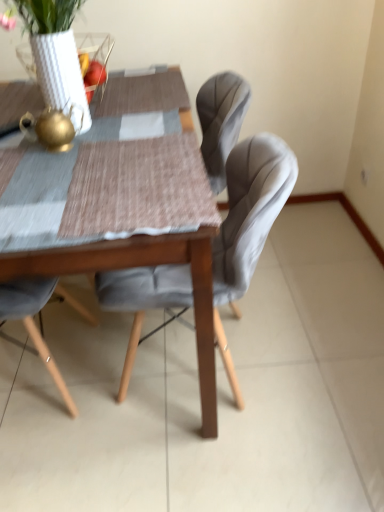
This screenshot has height=512, width=384. I want to click on free space above wooden table at center (from a real-world perspective), so click(x=96, y=138).